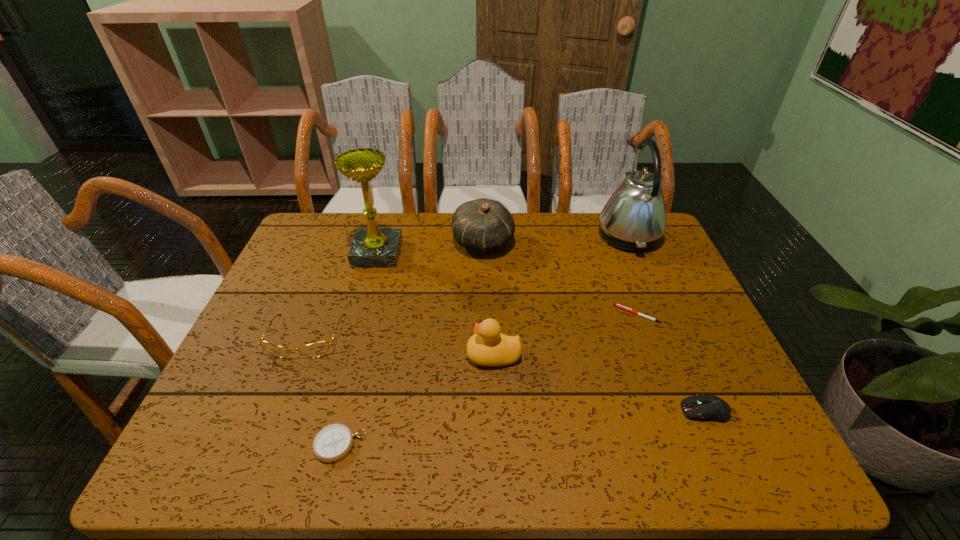
Image resolution: width=960 pixels, height=540 pixels. In order to click on kettle in this screenshot , I will do `click(634, 218)`.

Find the location of a particular element. The image size is (960, 540). award is located at coordinates (371, 248).

Locate an element on the screen. the sixth shortest object is located at coordinates (483, 225).

Identify the location of the fifth shortest object. This screenshot has height=540, width=960. (488, 346).

The image size is (960, 540). Identify the location of the fourth shortest object. (317, 349).

Where is `computer equipment`? computer equipment is located at coordinates (706, 407).

Where is `the second nearest object`? the second nearest object is located at coordinates (706, 407).

Where is `the nearest object`? the nearest object is located at coordinates (332, 443).

At what (x,y) coordinates should I click in order to perform the action: click on the second shortest object. Please return your answer as a coordinate pair (x, y). The height and width of the screenshot is (540, 960). Looking at the image, I should click on (332, 443).

You are a GUI agent. You are given a task and a screenshot of the screen. Output one action in this format:
    pyautogui.click(x=<x>, y=<y>)
    Task: Click on the shortest object
    The width and height of the screenshot is (960, 540).
    Given the screenshot: What is the action you would take?
    pyautogui.click(x=616, y=305)